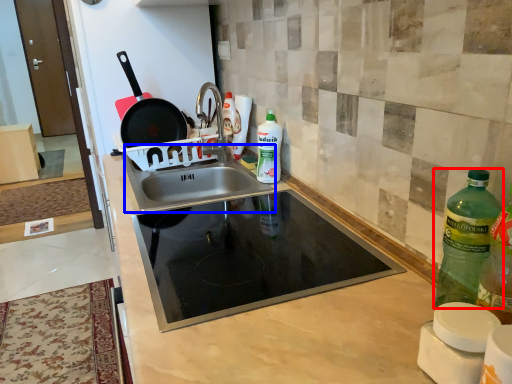
Question: Which point is closer to the camera, bottle (highlighted by a red box) or sink (highlighted by a blue box)?

Choices:
 (A) bottle
 (B) sink

Answer: (A)